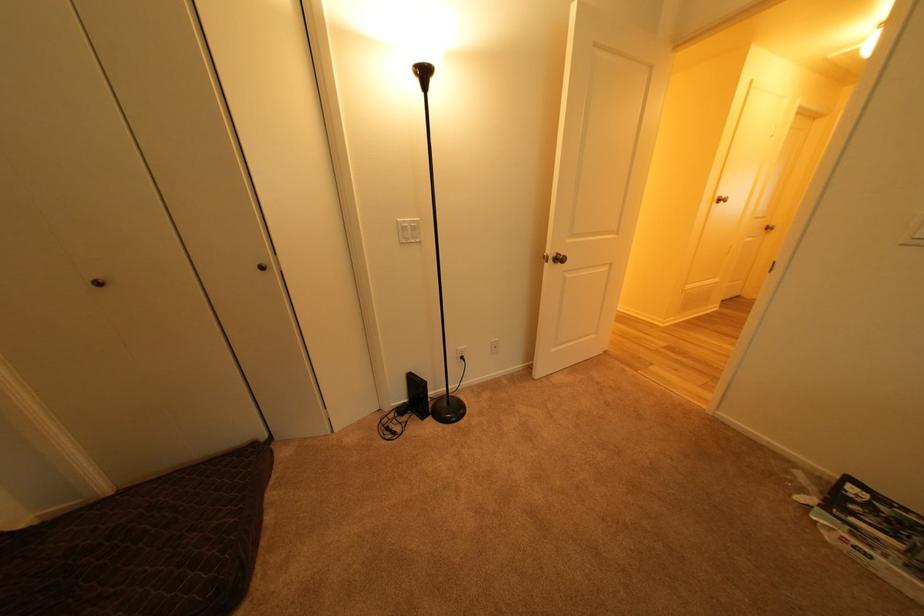
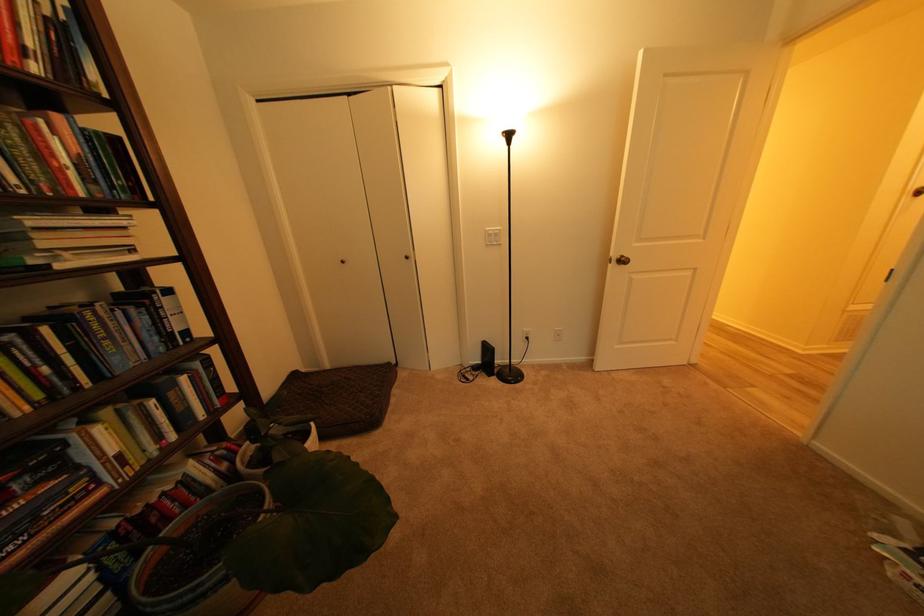
The point at (557, 264) is marked in the first image. Where is the corresponding point in the second image?

(621, 265)